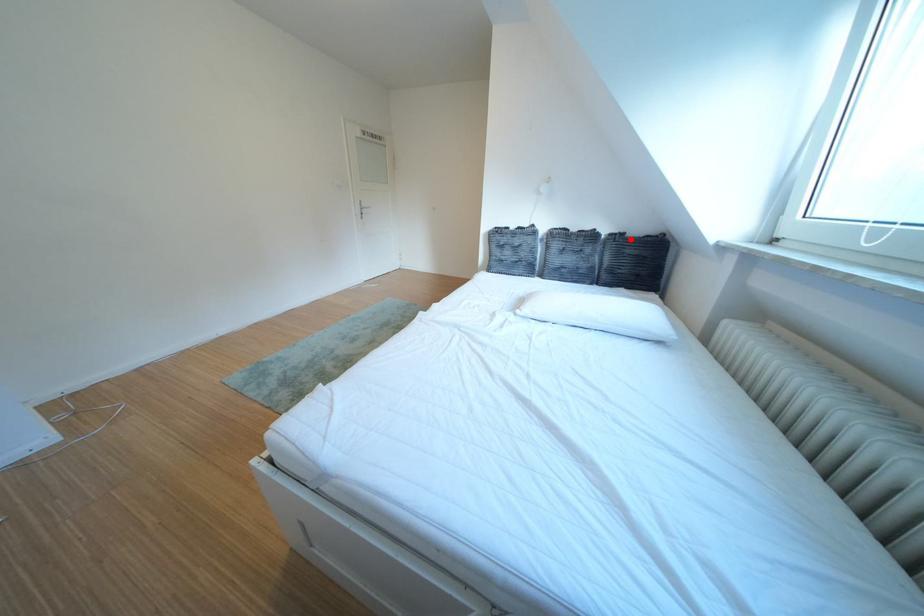
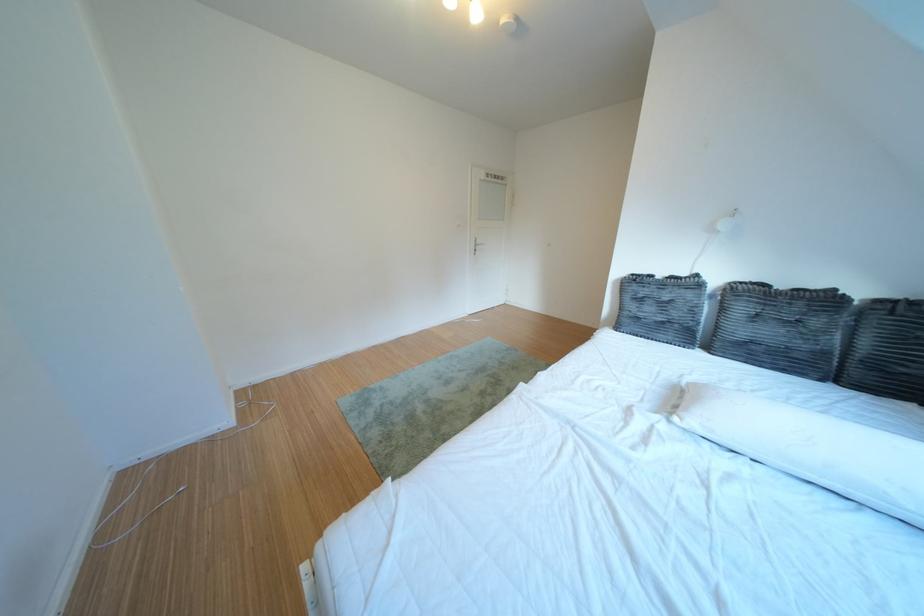
In the second image, find the point that corresponds to the highlighted location in the first image.

(910, 306)